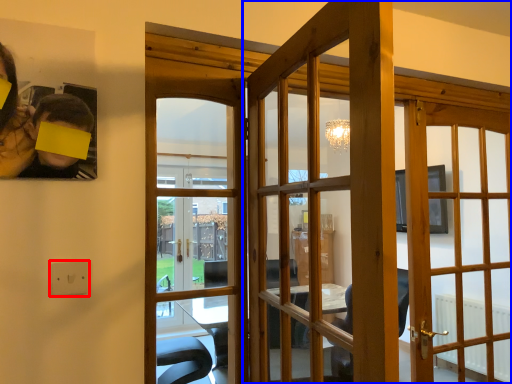
Question: Which of the following is the farthest to the observer, electric outlet (highlighted by a red box) or door (highlighted by a blue box)?

Choices:
 (A) electric outlet
 (B) door

Answer: (A)